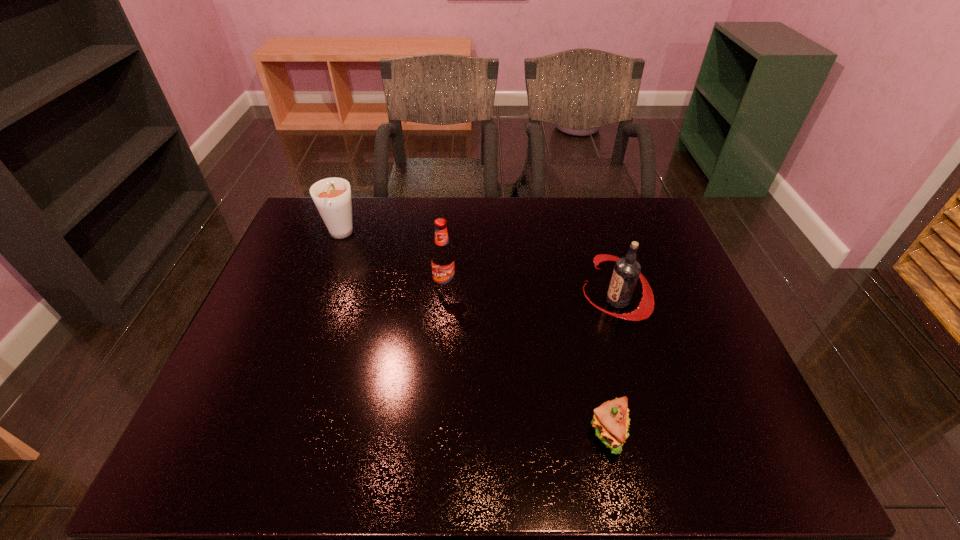
Where is `the third object from right to left`? the third object from right to left is located at coordinates (443, 263).

You are a GUI agent. You are given a task and a screenshot of the screen. Output one action in this format:
    pyautogui.click(x=<x>, y=<y>)
    Task: Click on the leftmost root beer
    The image size is (960, 540).
    Given the screenshot: What is the action you would take?
    pyautogui.click(x=332, y=196)

Where is `the farthest root beer`? This screenshot has width=960, height=540. the farthest root beer is located at coordinates (332, 196).

The width and height of the screenshot is (960, 540). What are the coordinates of `the rightmost root beer` in the screenshot? It's located at (626, 272).

This screenshot has height=540, width=960. In order to click on the shortest object in this screenshot , I will do `click(610, 420)`.

Where is `sandwich`? The height and width of the screenshot is (540, 960). sandwich is located at coordinates (610, 420).

Find the location of a particular element. The height and width of the screenshot is (540, 960). free space located on the back of the third object from right to left is located at coordinates (451, 218).

Locate an element on the screen. vacant space situated 0.350m on the drink side of the farthest root beer is located at coordinates (301, 341).

This screenshot has width=960, height=540. What are the coordinates of `vacant space located 0.120m on the label of the rightmost root beer` in the screenshot? It's located at (540, 301).

What are the coordinates of `vacant point located 0.200m on the label of the rightmost root beer` in the screenshot? It's located at (512, 301).